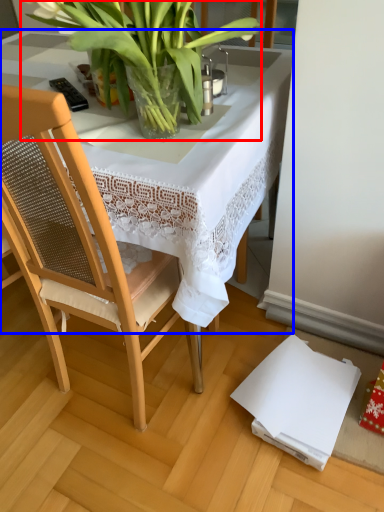
Question: Which of the following is the closest to the observer, houseplant (highlighted by a red box) or table (highlighted by a blue box)?

Choices:
 (A) houseplant
 (B) table

Answer: (A)